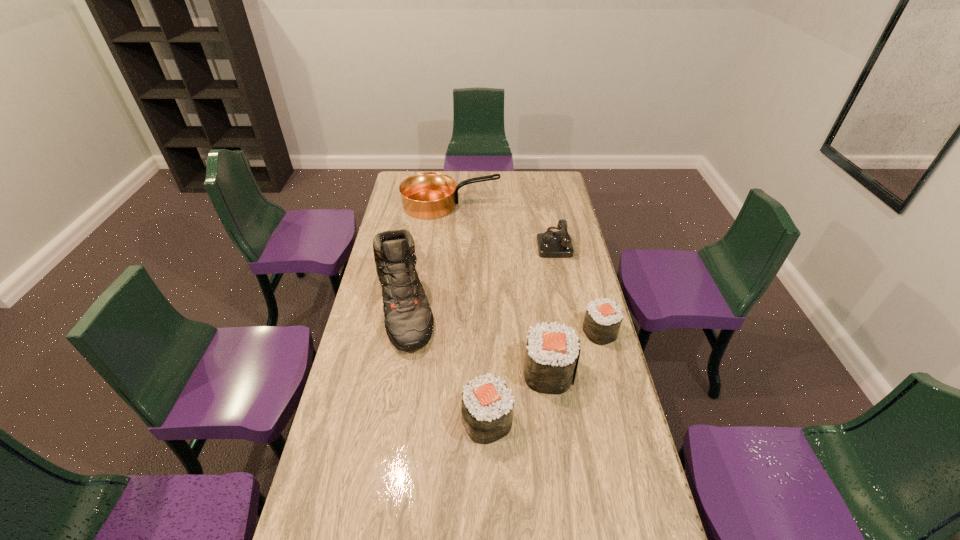
The height and width of the screenshot is (540, 960). What are the coordinates of `vacant space that satisfies the following two spatial constraints: 1. on the front side of the rightmost sushi; 2. on the right side of the tallest object` in the screenshot? It's located at (399, 332).

The height and width of the screenshot is (540, 960). I want to click on free region that satisfies the following two spatial constraints: 1. on the handle side of the farthest object; 2. on the back side of the second farthest sushi, so click(x=436, y=372).

Identify the location of vacant space that satisfies the following two spatial constraints: 1. on the handle side of the frying pan; 2. on the back side of the second farthest sushi. (436, 372).